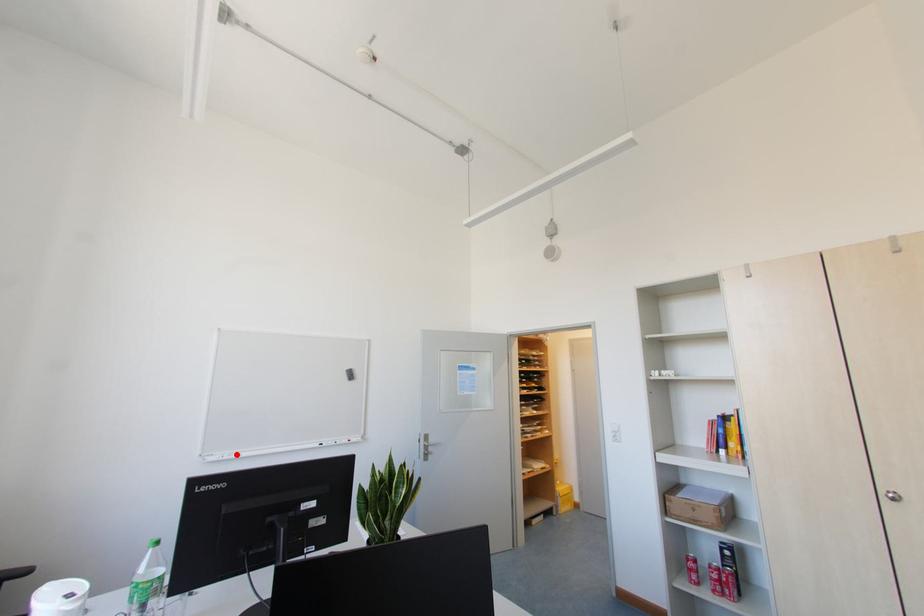
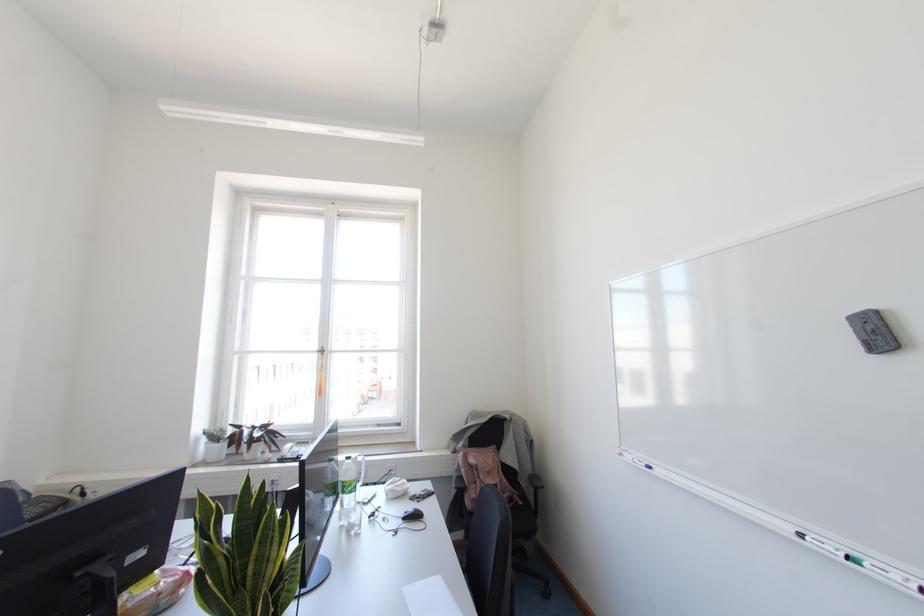
The point at the highlighted location is marked in the first image. Where is the corresponding point in the second image?

(649, 467)